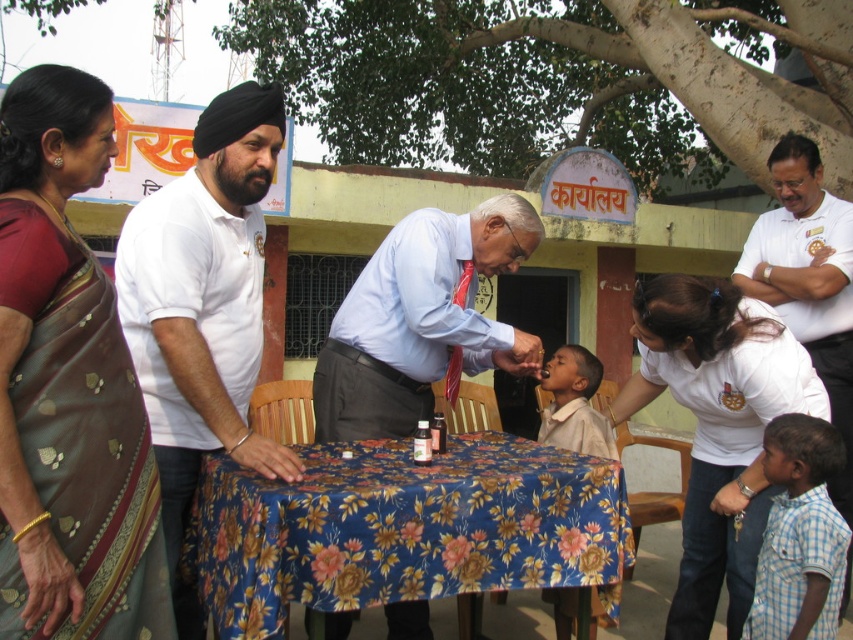
Question: Can you confirm if floral-patterned fabric at center is smaller than blue checkered shirt at lower right?

Choices:
 (A) yes
 (B) no

Answer: (B)

Question: Can you confirm if floral-patterned fabric at center is positioned above white cotton shirt at left?

Choices:
 (A) yes
 (B) no

Answer: (B)

Question: Among these points, which one is nearest to the camera?

Choices:
 (A) (563, 371)
 (B) (830, 280)
 (C) (602, 440)
 (D) (357, 609)

Answer: (D)

Question: Which object is positioned farthest from the light blue shirt at center?

Choices:
 (A) light brown cotton shirt at center
 (B) floral-patterned fabric at center
 (C) blue checkered shirt at lower right
 (D) white shirt at right

Answer: (D)

Question: Does floral-patterned fabric at center appear on the left side of light brown cotton shirt at center?

Choices:
 (A) no
 (B) yes

Answer: (B)

Question: Among these objects, which one is farthest from the camera?

Choices:
 (A) white cotton shirt at left
 (B) white shirt at right
 (C) light blue shirt at center
 (D) blue checkered shirt at lower right

Answer: (B)